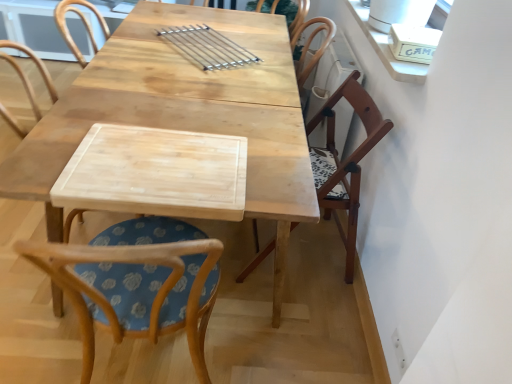
Where is `free space in front of wooden chair at right, which appears as the 1th chair when viewed from the right`? The width and height of the screenshot is (512, 384). free space in front of wooden chair at right, which appears as the 1th chair when viewed from the right is located at coordinates (295, 322).